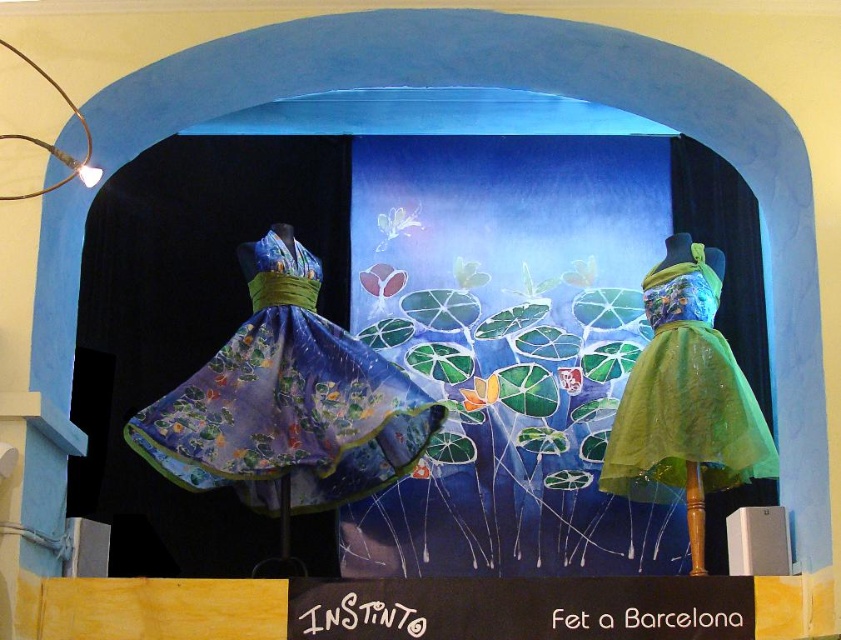
Question: Considering the relative positions of shiny blue fabric dress at left and green tulle dress at right in the image provided, where is shiny blue fabric dress at left located with respect to green tulle dress at right?

Choices:
 (A) above
 (B) below

Answer: (B)

Question: Is shiny blue fabric dress at left smaller than green tulle dress at right?

Choices:
 (A) yes
 (B) no

Answer: (B)

Question: Can you confirm if shiny blue fabric dress at left is thinner than green tulle dress at right?

Choices:
 (A) no
 (B) yes

Answer: (A)